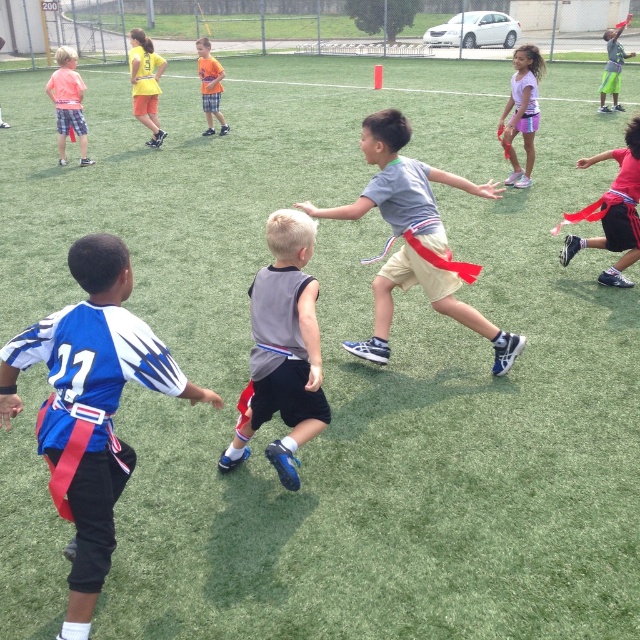
Question: Which of the following is the farthest from the observer?

Choices:
 (A) (212, 96)
 (B) (300, 317)
 (C) (70, 70)

Answer: (A)

Question: Which object is positioned closest to the red flag at upper right?

Choices:
 (A) blue jersey at center
 (B) yellow t-shirt at upper left

Answer: (B)

Question: Is gray fabric shirt at center to the left of purple fabric flag at upper right from the viewer's perspective?

Choices:
 (A) no
 (B) yes

Answer: (B)

Question: Can you confirm if purple fabric flag at upper right is smaller than matte plaid shorts at left?

Choices:
 (A) yes
 (B) no

Answer: (B)

Question: Estimate the real-world distances between objects in this image. Which object is closer to the gray matte tank top at center?

Choices:
 (A) gray fabric shirt at center
 (B) blue jersey at center

Answer: (B)

Question: From the image, what is the correct spatial relationship of gray matte tank top at center in relation to purple fabric flag at upper right?

Choices:
 (A) above
 (B) below

Answer: (B)